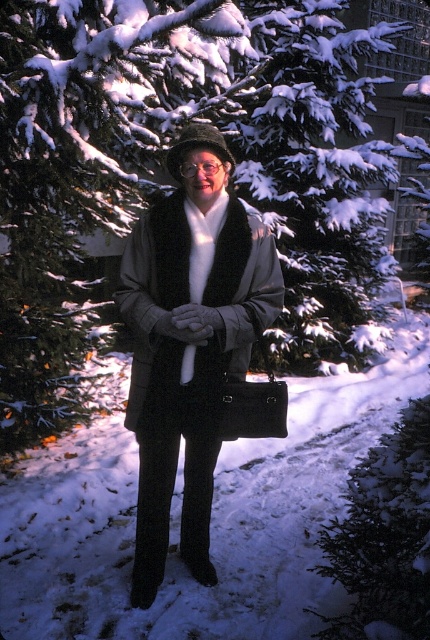
Between snow-covered evergreen tree at center and transparent plastic goggles at center, which one appears on the right side from the viewer's perspective?

Positioned to the right is transparent plastic goggles at center.

Measure the distance between point (326,156) and camera.

Point (326,156) is 6.33 meters away from camera.

What do you see at coordinates (162, 163) in the screenshot?
I see `snow-covered evergreen tree at center` at bounding box center [162, 163].

Find the location of a particular element. The image size is (430, 640). snow-covered evergreen tree at center is located at coordinates (162, 163).

Which of these two, snow-covered evergreen tree at center or matte black coat at center, stands shorter?

With less height is matte black coat at center.

Who is more forward, (227, 104) or (184, 138)?

Point (184, 138) is in front.

This screenshot has height=640, width=430. Identify the location of snow-covered evergreen tree at center. (162, 163).

Measure the distance between matte black coat at center and transparent plastic goggles at center.

matte black coat at center and transparent plastic goggles at center are 28.38 inches apart.

Does matte black coat at center appear over transparent plastic goggles at center?

Actually, matte black coat at center is below transparent plastic goggles at center.

The width and height of the screenshot is (430, 640). I want to click on matte black coat at center, so click(x=189, y=344).